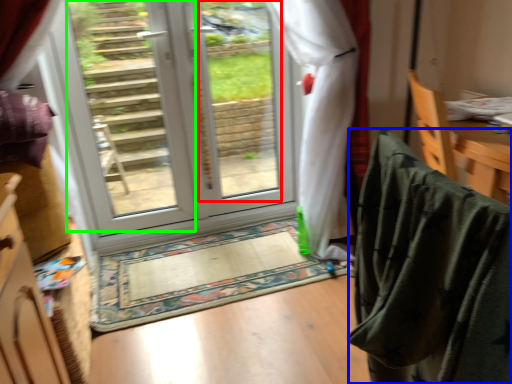
Question: Which object is positioned closest to window screen (highlighted by a red box)? Select from blanket (highlighted by a blue box) and glass door (highlighted by a green box).

Choices:
 (A) blanket
 (B) glass door

Answer: (B)